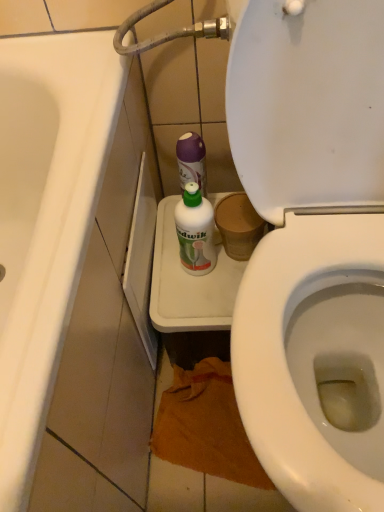
Question: Is white plastic bottle at center wider than white glossy bathtub at left?

Choices:
 (A) yes
 (B) no

Answer: (B)

Question: Is white plastic bottle at center positioned before white glossy bathtub at left?

Choices:
 (A) no
 (B) yes

Answer: (A)

Question: Does white plastic bottle at center have a greater height compared to white glossy bathtub at left?

Choices:
 (A) no
 (B) yes

Answer: (A)

Question: Is white plastic bottle at center not close to white glossy bathtub at left?

Choices:
 (A) no
 (B) yes

Answer: (A)

Question: Does white plastic bottle at center have a smaller size compared to white glossy bathtub at left?

Choices:
 (A) yes
 (B) no

Answer: (A)

Question: Is the depth of white plastic bottle at center greater than that of white glossy bathtub at left?

Choices:
 (A) no
 (B) yes

Answer: (B)

Question: Considering the relative sizes of white glossy bathtub at left and white plastic bottle at center in the image provided, is white glossy bathtub at left taller than white plastic bottle at center?

Choices:
 (A) no
 (B) yes

Answer: (B)

Question: From a real-world perspective, is white glossy bathtub at left on white plastic bottle at center?

Choices:
 (A) no
 (B) yes

Answer: (A)

Question: Is white glossy bathtub at left oriented towards white plastic bottle at center?

Choices:
 (A) yes
 (B) no

Answer: (A)

Question: Is white glossy bathtub at left looking in the opposite direction of white plastic bottle at center?

Choices:
 (A) yes
 (B) no

Answer: (A)

Question: From a real-world perspective, is white glossy bathtub at left under white plastic bottle at center?

Choices:
 (A) yes
 (B) no

Answer: (A)

Question: Can you confirm if white glossy bathtub at left is bigger than white plastic bottle at center?

Choices:
 (A) yes
 (B) no

Answer: (A)

Question: Relative to white plastic bottle at center, is white glossy bathtub at left in front or behind?

Choices:
 (A) behind
 (B) front

Answer: (B)